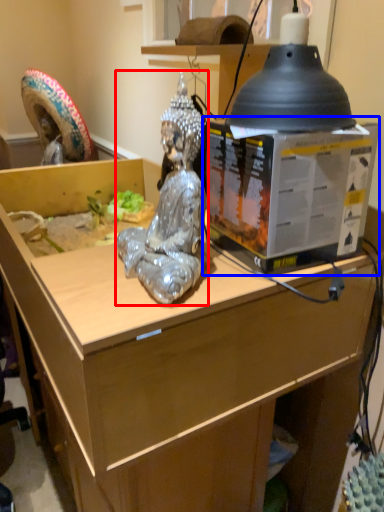
Question: Which point is closer to the camera, person (highlighted by a red box) or box (highlighted by a blue box)?

Choices:
 (A) person
 (B) box

Answer: (A)